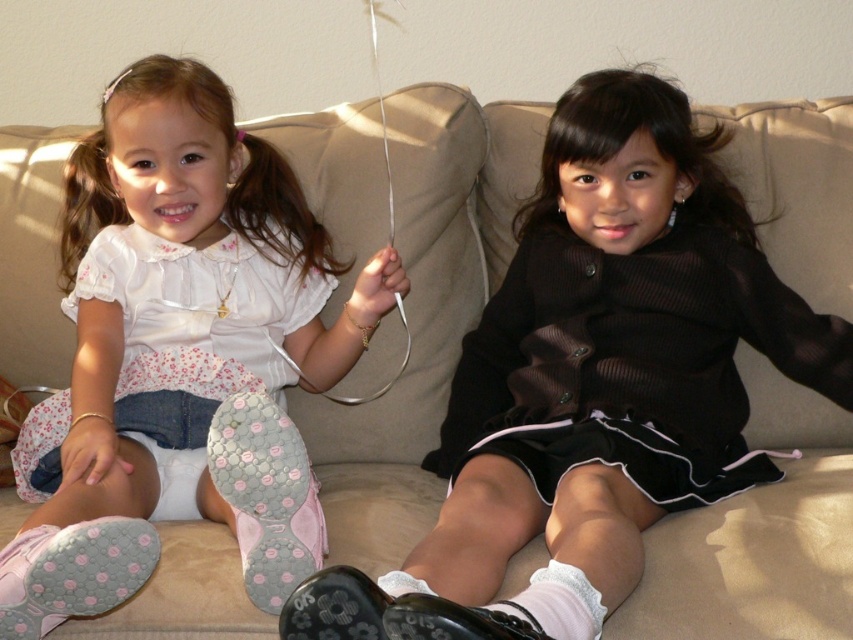
Question: Is matte black dress at center bigger than matte pink sneakers at lower left?

Choices:
 (A) no
 (B) yes

Answer: (B)

Question: Which point is closer to the camera taking this photo?

Choices:
 (A) (492, 390)
 (B) (146, 308)

Answer: (B)

Question: Among these objects, which one is farthest from the camera?

Choices:
 (A) matte black dress at center
 (B) matte pink sneakers at lower left

Answer: (B)

Question: Is matte black dress at center to the right of matte pink sneakers at lower left from the viewer's perspective?

Choices:
 (A) no
 (B) yes

Answer: (B)

Question: Where is matte black dress at center located in relation to matte pink sneakers at lower left in the image?

Choices:
 (A) below
 (B) above

Answer: (A)

Question: Which point is farther to the camera?

Choices:
 (A) matte black dress at center
 (B) matte pink sneakers at lower left

Answer: (B)